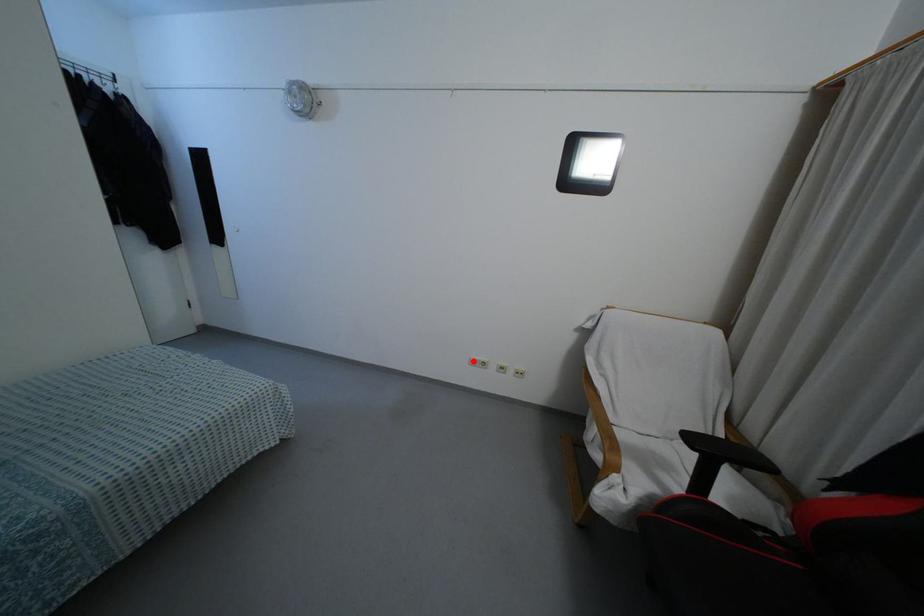
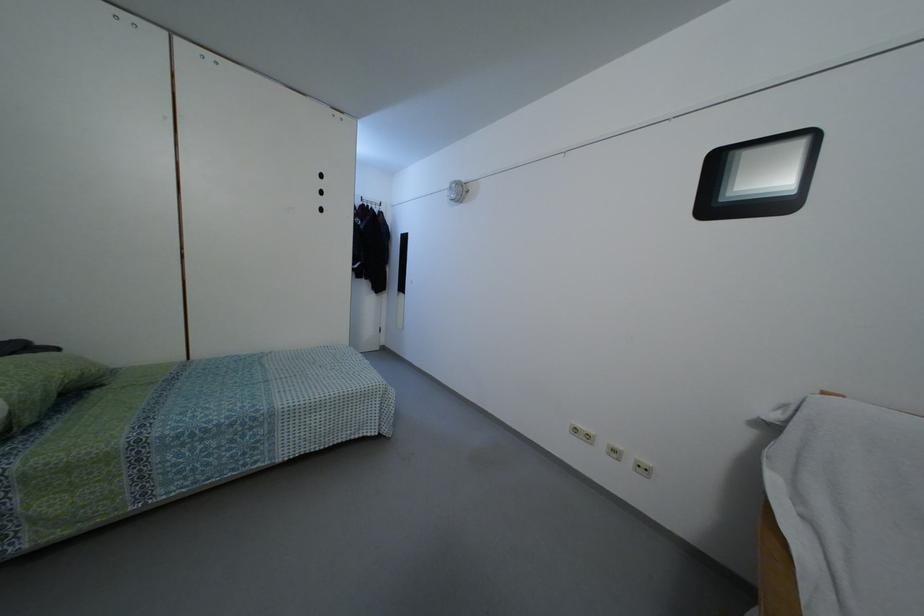
Find the pixel in the second image that matches the highlighted location in the first image.

(575, 430)